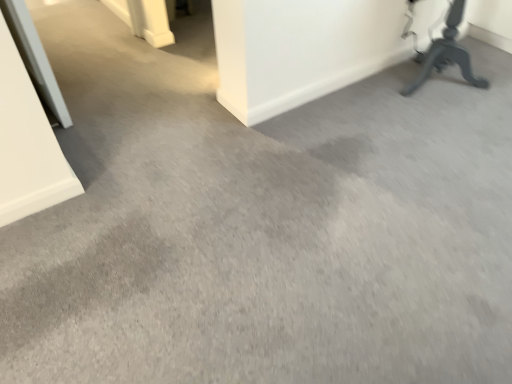
This screenshot has width=512, height=384. What do you see at coordinates (446, 53) in the screenshot?
I see `matte gray tripod at upper right` at bounding box center [446, 53].

Locate an element on the screen. Image resolution: width=512 pixels, height=384 pixels. matte gray tripod at upper right is located at coordinates (446, 53).

This screenshot has width=512, height=384. What are the coordinates of `matte gray tripod at upper right` in the screenshot? It's located at (446, 53).